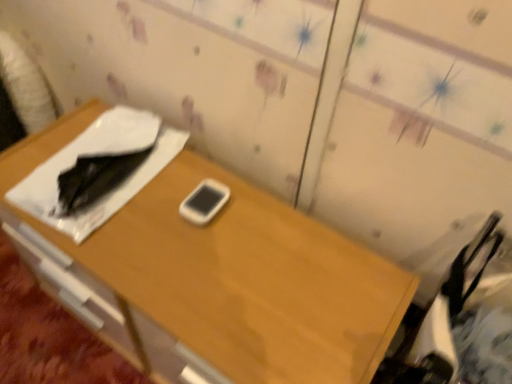
Identify the location of blank space to the left of white matte mobile phone at center. Image resolution: width=512 pixels, height=384 pixels. (145, 213).